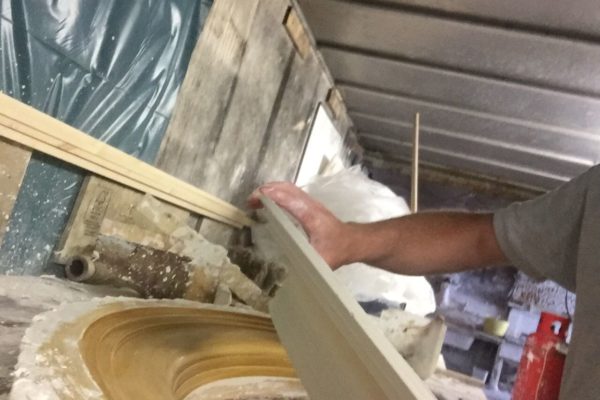
Where is `wood sill`? wood sill is located at coordinates (117, 153).